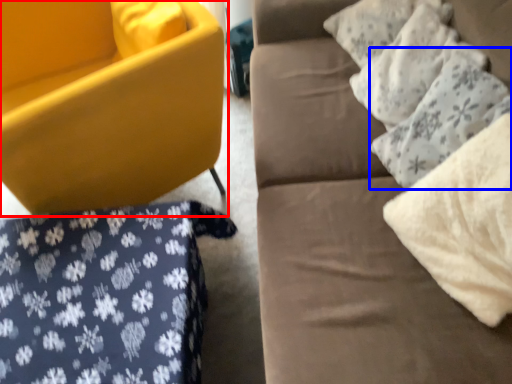
Question: Which object is closer to the camera taking this photo, chair (highlighted by a red box) or pillow (highlighted by a blue box)?

Choices:
 (A) chair
 (B) pillow

Answer: (B)